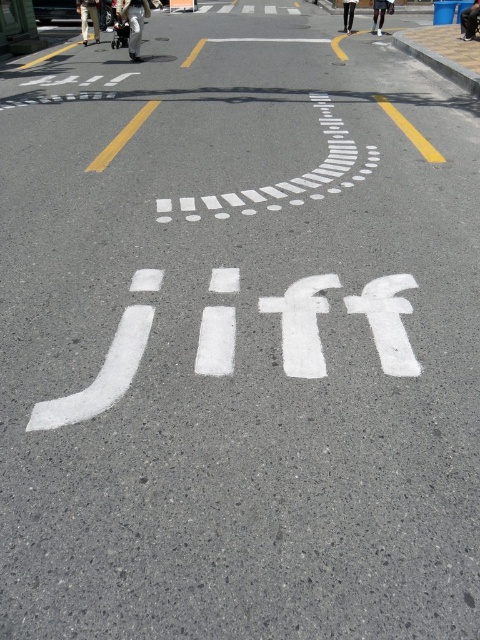
Question: Among these points, which one is farthest from the camera?

Choices:
 (A) (142, 26)
 (B) (463, 29)
 (C) (348, 20)

Answer: (C)

Question: Is dark blue jeans at center positioned at the back of black pants at upper center?

Choices:
 (A) yes
 (B) no

Answer: (B)

Question: Does black pants at upper right appear on the left side of black pants at upper center?

Choices:
 (A) no
 (B) yes

Answer: (A)

Question: Considering the real-world distances, which object is farthest from the light gray fabric jacket at upper center?

Choices:
 (A) dark blue jeans at center
 (B) black pants at upper center

Answer: (A)

Question: Which of the following is the closest to the observer?

Choices:
 (A) pyautogui.click(x=463, y=35)
 (B) pyautogui.click(x=92, y=17)

Answer: (A)

Question: Does khaki pants at center appear on the left side of dark blue jeans at center?

Choices:
 (A) yes
 (B) no

Answer: (A)